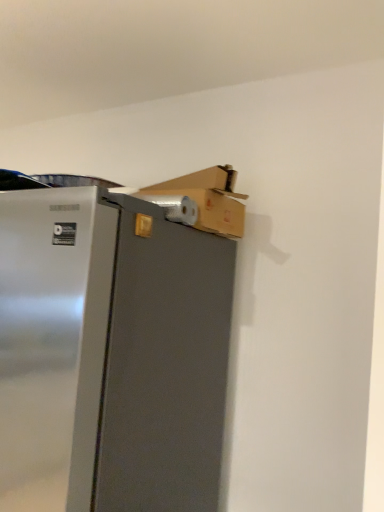
The width and height of the screenshot is (384, 512). What do you see at coordinates (113, 350) in the screenshot?
I see `satin silver refrigerator at upper left` at bounding box center [113, 350].

Measure the distance between point [128,244] and camera.

Point [128,244] and camera are 38.54 inches apart from each other.

Find the location of a particular element. This screenshot has height=512, width=384. satin silver refrigerator at upper left is located at coordinates (113, 350).

Locate an element on the screen. This screenshot has height=512, width=384. cardboard box at upper right is located at coordinates (209, 199).

Describe the element at coordinates (209, 199) in the screenshot. This screenshot has width=384, height=512. I see `cardboard box at upper right` at that location.

Where is `satin silver refrigerator at upper left`? The height and width of the screenshot is (512, 384). satin silver refrigerator at upper left is located at coordinates (113, 350).

Between satin silver refrigerator at upper left and cardboard box at upper right, which one appears on the left side from the viewer's perspective?

From the viewer's perspective, satin silver refrigerator at upper left appears more on the left side.

In the image, is satin silver refrigerator at upper left positioned in front of or behind cardboard box at upper right?

Clearly, satin silver refrigerator at upper left is in front of cardboard box at upper right.

Does point (82, 215) appear closer or farther from the camera than point (235, 210)?

Point (82, 215) appears to be closer to the viewer than point (235, 210).

From the image's perspective, is satin silver refrigerator at upper left beneath cardboard box at upper right?

Yes, from the image's perspective, satin silver refrigerator at upper left is beneath cardboard box at upper right.

From a real-world perspective, is satin silver refrigerator at upper left below cardboard box at upper right?

Yes.

Is satin silver refrigerator at upper left wider than cardboard box at upper right?

Indeed, satin silver refrigerator at upper left has a greater width compared to cardboard box at upper right.

Considering the sizes of objects satin silver refrigerator at upper left and cardboard box at upper right in the image provided, who is taller, satin silver refrigerator at upper left or cardboard box at upper right?

Standing taller between the two is satin silver refrigerator at upper left.

Considering the relative sizes of satin silver refrigerator at upper left and cardboard box at upper right in the image provided, is satin silver refrigerator at upper left bigger than cardboard box at upper right?

Correct, satin silver refrigerator at upper left is larger in size than cardboard box at upper right.

Is cardboard box at upper right completely or partially inside satin silver refrigerator at upper left?

Definitely not — cardboard box at upper right is not inside satin silver refrigerator at upper left.

Is there a large distance between satin silver refrigerator at upper left and cardboard box at upper right?

That's not correct — satin silver refrigerator at upper left is a little close to cardboard box at upper right.

Is satin silver refrigerator at upper left facing away from cardboard box at upper right?

No.

From the picture: How much distance is there between satin silver refrigerator at upper left and cardboard box at upper right?

satin silver refrigerator at upper left and cardboard box at upper right are 12.64 inches apart.

Identify the location of refrigerator that is under the cardboard box at upper right (from a real-world perspective). Image resolution: width=384 pixels, height=512 pixels. (113, 350).

Considering the positions of objects cardboard box at upper right and satin silver refrigerator at upper left in the image provided, who is more to the right, cardboard box at upper right or satin silver refrigerator at upper left?

cardboard box at upper right is more to the right.

Is cardboard box at upper right positioned behind satin silver refrigerator at upper left?

That is True.

Is point (226, 167) farther from camera compared to point (201, 509)?

Yes, point (226, 167) is behind point (201, 509).

From the image's perspective, relative to satin silver refrigerator at upper left, is cardboard box at upper right above or below?

From the image's perspective, cardboard box at upper right appears above satin silver refrigerator at upper left.

From a real-world perspective, relative to satin silver refrigerator at upper left, is cardboard box at upper right vertically above or below?

cardboard box at upper right is situated higher than satin silver refrigerator at upper left in the real world.

Looking at this image, which of these two, cardboard box at upper right or satin silver refrigerator at upper left, is wider?

satin silver refrigerator at upper left is wider.

Considering the sizes of objects cardboard box at upper right and satin silver refrigerator at upper left in the image provided, who is shorter, cardboard box at upper right or satin silver refrigerator at upper left?

cardboard box at upper right.

Based on their sizes in the image, would you say cardboard box at upper right is bigger or smaller than satin silver refrigerator at upper left?

In the image, cardboard box at upper right appears to be smaller than satin silver refrigerator at upper left.

Is cardboard box at upper right surrounding satin silver refrigerator at upper left?

No, satin silver refrigerator at upper left is located outside of cardboard box at upper right.

Is cardboard box at upper right next to satin silver refrigerator at upper left?

No, cardboard box at upper right is not with satin silver refrigerator at upper left.

Is cardboard box at upper right facing towards satin silver refrigerator at upper left?

No, cardboard box at upper right is not facing towards satin silver refrigerator at upper left.

You are a GUI agent. You are given a task and a screenshot of the screen. Output one action in this format:
    pyautogui.click(x=<x>, y=<y>)
    Task: Click on the cardboard box above the satin silver refrigerator at upper left (from a real-world perspective)
    This screenshot has height=512, width=384.
    Given the screenshot: What is the action you would take?
    pyautogui.click(x=209, y=199)

Identify the location of refrigerator below the cardboard box at upper right (from the image's perspective). (113, 350).

Identify the location of refrigerator that appears on the left of cardboard box at upper right. The height and width of the screenshot is (512, 384). (113, 350).